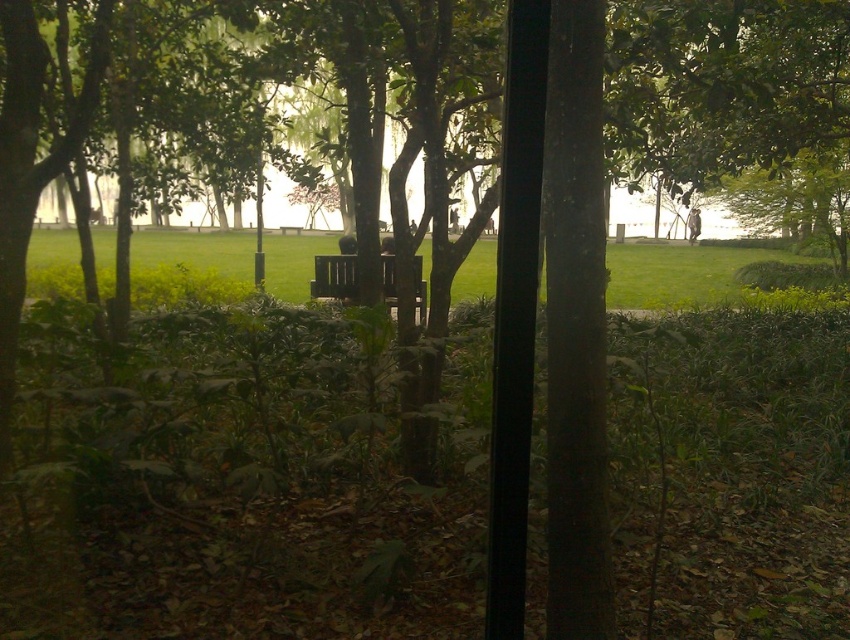
Does green grassy at center have a lesser width compared to wooden bench at center?

Incorrect, green grassy at center's width is not less than wooden bench at center's.

At what (x,y) coordinates should I click in order to perform the action: click on green grassy at center. Please return your answer as a coordinate pair (x, y). This screenshot has width=850, height=640. Looking at the image, I should click on (680, 272).

Does point (473, 264) come behind point (384, 262)?

Yes, it is behind point (384, 262).

Where is `green grassy at center`? The width and height of the screenshot is (850, 640). green grassy at center is located at coordinates (680, 272).